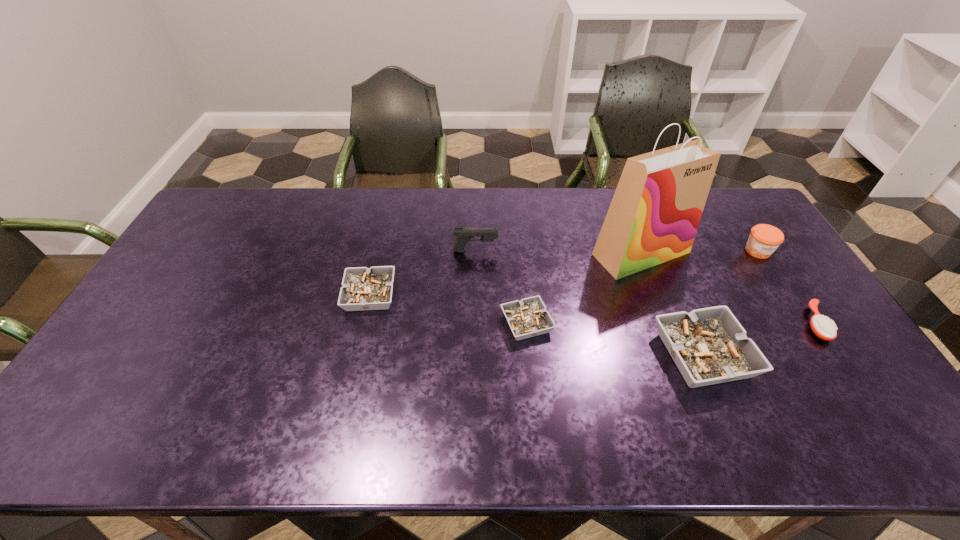
Locate an element on the screen. the leftmost object is located at coordinates (363, 288).

Identify the location of the second shortest ashtray. (363, 288).

Where is `the second ashtray from right to left`? Image resolution: width=960 pixels, height=540 pixels. the second ashtray from right to left is located at coordinates (527, 318).

The image size is (960, 540). I want to click on the shortest ashtray, so click(527, 318).

Where is `the tallest ashtray`? the tallest ashtray is located at coordinates (709, 346).

Identify the location of the rightmost ashtray. (709, 346).

Where is `jam`? Image resolution: width=960 pixels, height=540 pixels. jam is located at coordinates (764, 239).

This screenshot has height=540, width=960. In order to click on shopping bag in this screenshot , I will do `click(654, 215)`.

Find the location of a particular element. The image size is (960, 540). pistol is located at coordinates tap(464, 235).

This screenshot has width=960, height=540. I want to click on the sixth shortest object, so click(464, 235).